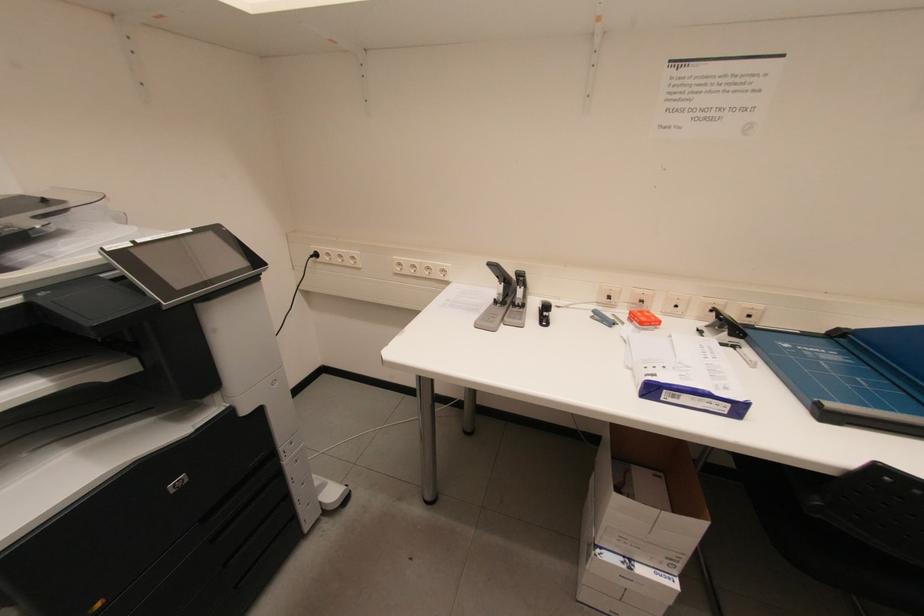
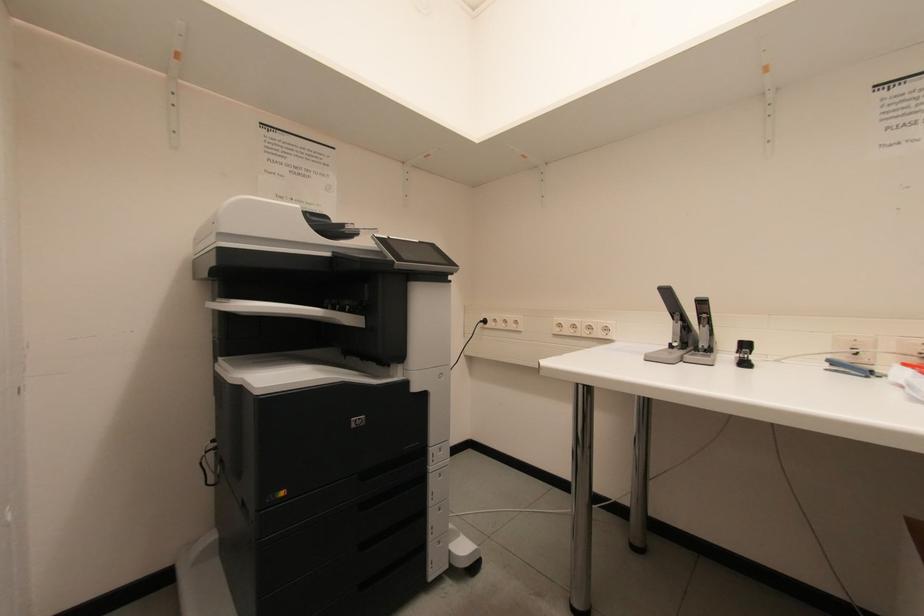
How did the camera likely rotate?

The camera's rotation is toward left-up.